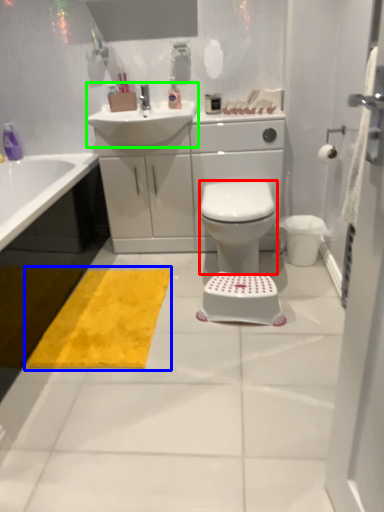
Question: Which is farther away from bidet (highlighted by a red box)? doormat (highlighted by a blue box) or sink (highlighted by a green box)?

Choices:
 (A) doormat
 (B) sink

Answer: (B)